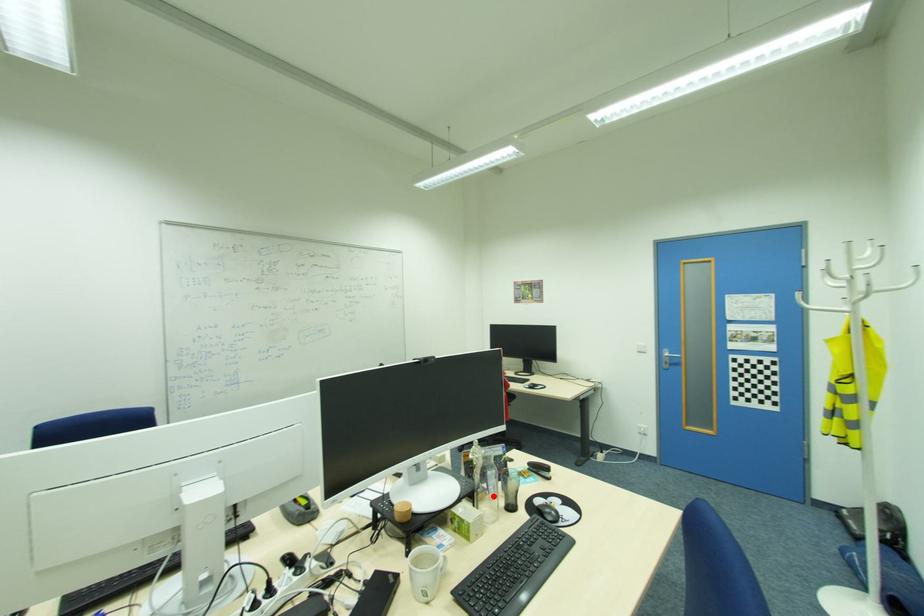
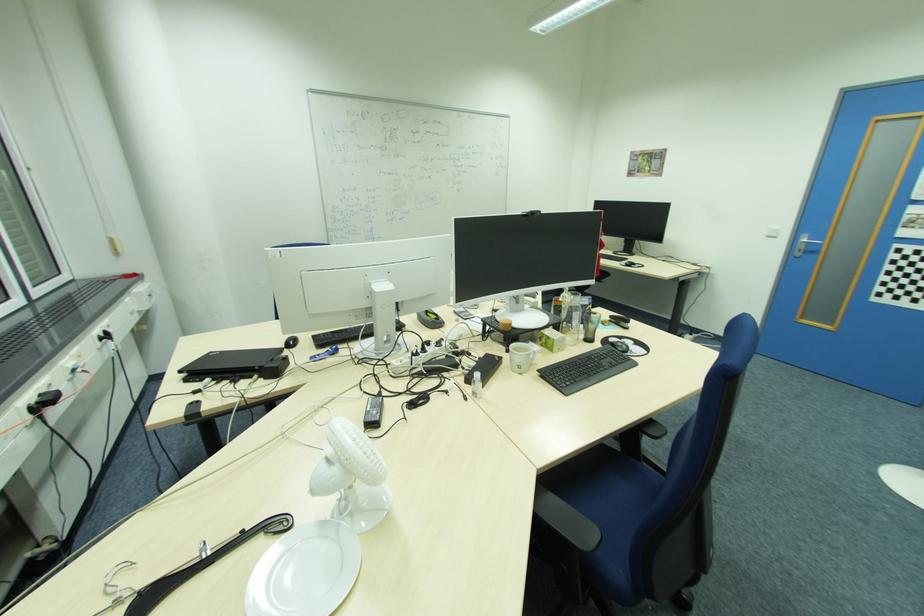
Question: I am providing you with two images of the same scene from different viewpoints. A red point is marked on the first image. At the location where the point appears in image 1, is it still visible in image 2?

Choices:
 (A) Yes
 (B) No

Answer: (A)